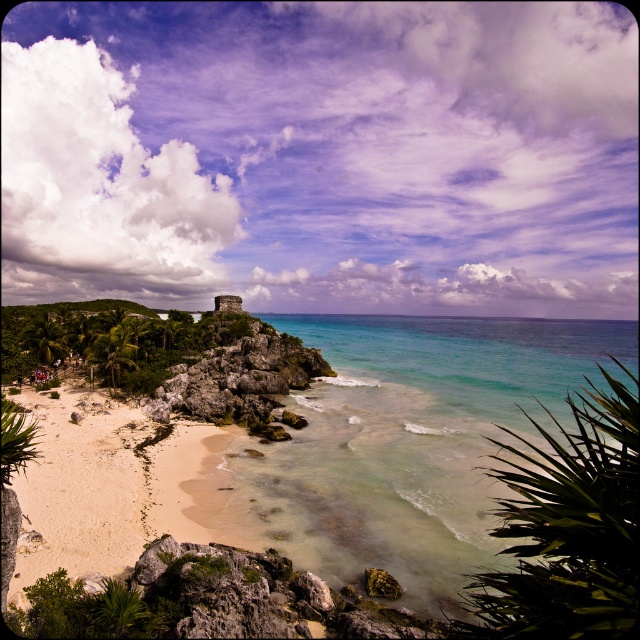
Is clear glass water at center shorter than green leafy palm tree at lower right?

In fact, clear glass water at center may be taller than green leafy palm tree at lower right.

Who is positioned more to the right, clear glass water at center or green leafy palm tree at lower right?

Positioned to the right is clear glass water at center.

Between point (602, 362) and point (588, 476), which one is positioned behind?

Point (602, 362)

You are a GUI agent. You are given a task and a screenshot of the screen. Output one action in this format:
    pyautogui.click(x=<x>, y=<y>)
    Task: Click on the clear glass water at center
    
    Given the screenshot: What is the action you would take?
    pyautogui.click(x=417, y=440)

Between clear glass water at center and rockyrough stonerocky formation at center-left, which one is positioned lower?

rockyrough stonerocky formation at center-left is lower down.

Can you confirm if clear glass water at center is shorter than rockyrough stonerocky formation at center-left?

In fact, clear glass water at center may be taller than rockyrough stonerocky formation at center-left.

Consider the image. Measure the distance between clear glass water at center and camera.

A distance of 24.04 meters exists between clear glass water at center and camera.

This screenshot has height=640, width=640. Identify the location of clear glass water at center. (417, 440).

Is the position of green leafy palm tree at lower right less distant than that of rockyrough stonerocky formation at center-left?

That is True.

Who is lower down, green leafy palm tree at lower right or rockyrough stonerocky formation at center-left?

green leafy palm tree at lower right is lower down.

Which is behind, point (556, 621) or point (275, 355)?

The point (275, 355) is more distant.

You are a GUI agent. You are given a task and a screenshot of the screen. Output one action in this format:
    pyautogui.click(x=<x>, y=<y>)
    Task: Click on the green leafy palm tree at lower right
    The image size is (640, 640).
    Given the screenshot: What is the action you would take?
    pyautogui.click(x=566, y=529)